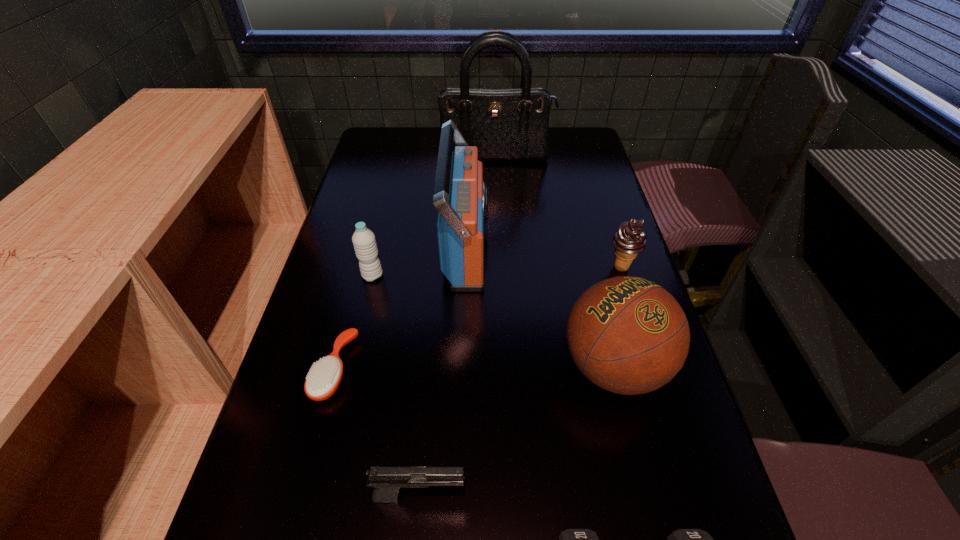
This screenshot has width=960, height=540. Identify the location of the farthest object. (504, 124).

Where is `the tallest object`? The width and height of the screenshot is (960, 540). the tallest object is located at coordinates (504, 124).

Where is `the second tallest object`? This screenshot has width=960, height=540. the second tallest object is located at coordinates (460, 196).

The image size is (960, 540). In order to click on the third tallest object in this screenshot , I will do `click(627, 335)`.

Find the location of a particular element. This screenshot has height=540, width=960. water bottle is located at coordinates (364, 242).

At what (x,y) coordinates should I click in order to perform the action: click on icecream. Please return your answer as a coordinate pair (x, y). This screenshot has height=540, width=960. Looking at the image, I should click on (629, 240).

Locate an element on the screen. The image size is (960, 540). the third shortest object is located at coordinates (387, 481).

The width and height of the screenshot is (960, 540). I want to click on the seventh farthest object, so click(387, 481).

Image resolution: width=960 pixels, height=540 pixels. I want to click on hairbrush, so coord(324,377).

Find the location of a particular element. vacant region located 0.380m with an open clasp on the front of the handbag is located at coordinates (499, 237).